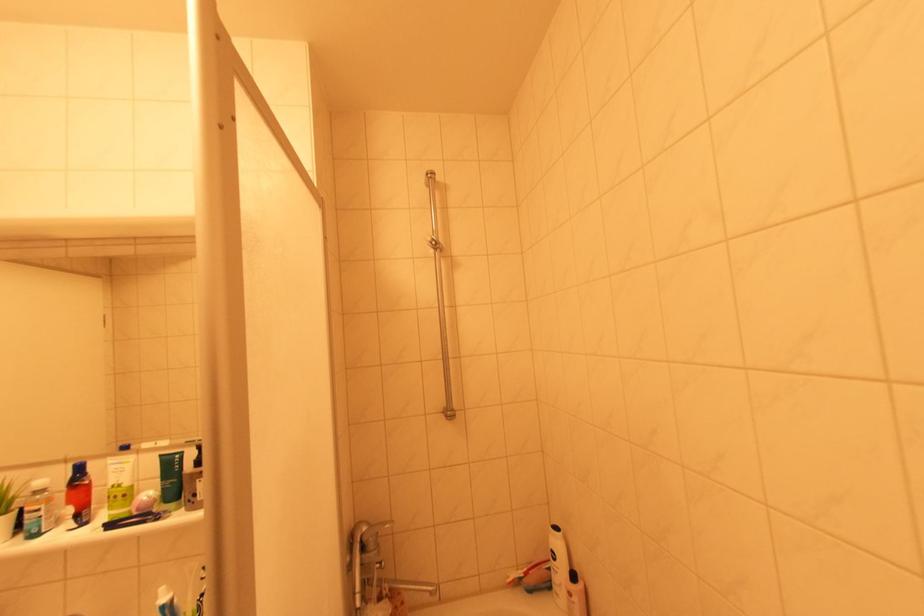
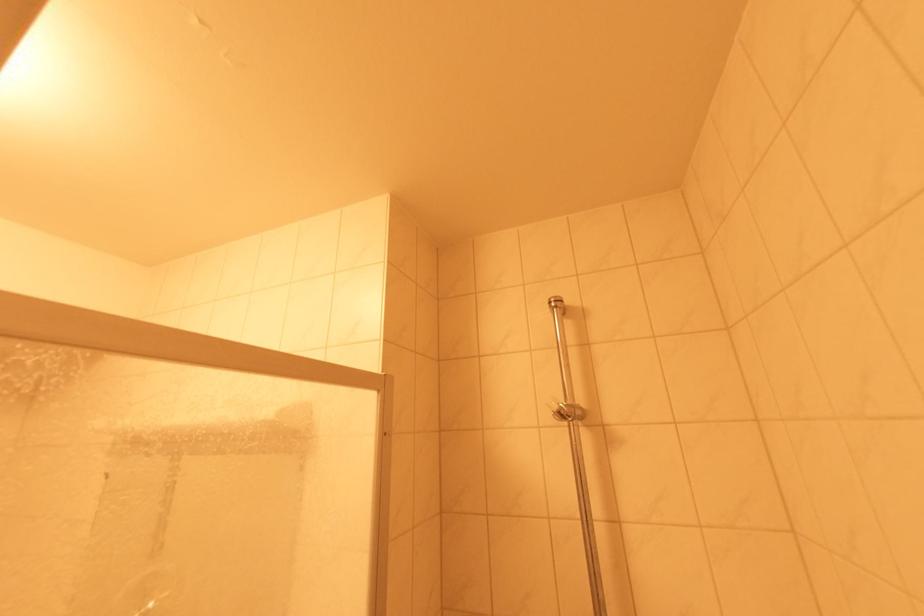
Question: How did the camera likely rotate?

Choices:
 (A) Left
 (B) Right
 (C) Up
 (D) Down

Answer: (A)